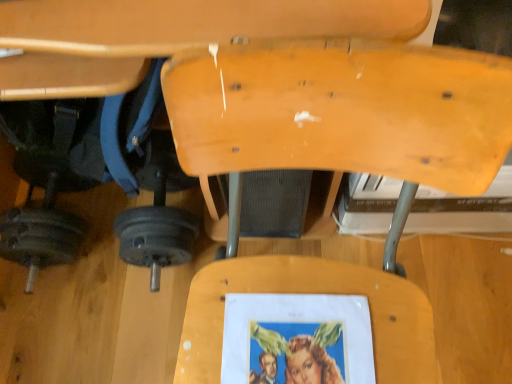
What do you see at coordinates (157, 230) in the screenshot? I see `dark gray metallic barbell at lower left` at bounding box center [157, 230].

Measure the distance between point (176, 250) and camera.

Point (176, 250) and camera are 1.03 meters apart from each other.

This screenshot has height=384, width=512. In order to click on dark gray metallic barbell at lower left in this screenshot , I will do `click(157, 230)`.

In order to face wooden swivel chair at center, should I rotate leftwards or rightwards?

Rotate your view left by about 20.195°.

This screenshot has height=384, width=512. I want to click on wooden swivel chair at center, so click(343, 111).

What is the approximate width of wooden swivel chair at center?

28.34 inches.

The height and width of the screenshot is (384, 512). What do you see at coordinates (343, 111) in the screenshot? I see `wooden swivel chair at center` at bounding box center [343, 111].

The width and height of the screenshot is (512, 384). I want to click on dark gray metallic barbell at lower left, so click(157, 230).

Considering the positions of objects dark gray metallic barbell at lower left and wooden swivel chair at center in the image provided, who is more to the left, dark gray metallic barbell at lower left or wooden swivel chair at center?

Positioned to the left is dark gray metallic barbell at lower left.

In the scene shown: Relative to wooden swivel chair at center, is dark gray metallic barbell at lower left in front or behind?

dark gray metallic barbell at lower left is positioned farther from the viewer than wooden swivel chair at center.

Is point (115, 229) less distant than point (316, 74)?

No, it is behind (316, 74).

From the image's perspective, does dark gray metallic barbell at lower left appear higher than wooden swivel chair at center?

No, from the image's perspective, dark gray metallic barbell at lower left is not on top of wooden swivel chair at center.

From a real-world perspective, is dark gray metallic barbell at lower left positioned under wooden swivel chair at center based on gravity?

Correct, in the physical world, dark gray metallic barbell at lower left is lower than wooden swivel chair at center.

Between dark gray metallic barbell at lower left and wooden swivel chair at center, which one has smaller width?

dark gray metallic barbell at lower left.

Consider the image. Which of these two, dark gray metallic barbell at lower left or wooden swivel chair at center, stands taller?

With more height is wooden swivel chair at center.

Can you confirm if dark gray metallic barbell at lower left is smaller than wooden swivel chair at center?

Yes, dark gray metallic barbell at lower left is smaller than wooden swivel chair at center.

Would you say dark gray metallic barbell at lower left is inside or outside wooden swivel chair at center?

The correct answer is: inside.

Are dark gray metallic barbell at lower left and wooden swivel chair at center making contact?

dark gray metallic barbell at lower left and wooden swivel chair at center are not in contact.

Is dark gray metallic barbell at lower left facing towards wooden swivel chair at center?

Yes, dark gray metallic barbell at lower left is facing wooden swivel chair at center.

Measure the distance from dark gray metallic barbell at lower left to wooden swivel chair at center.

The distance of dark gray metallic barbell at lower left from wooden swivel chair at center is 59.33 centimeters.

Identify the location of swivel chair above the dark gray metallic barbell at lower left (from a real-world perspective). (343, 111).

Which is more to the right, wooden swivel chair at center or dark gray metallic barbell at lower left?

From the viewer's perspective, wooden swivel chair at center appears more on the right side.

Is wooden swivel chair at center positioned behind dark gray metallic barbell at lower left?

No, wooden swivel chair at center is closer to the camera.

Is point (248, 91) closer to camera compared to point (49, 225)?

Yes.

From the image's perspective, which is above, wooden swivel chair at center or dark gray metallic barbell at lower left?

wooden swivel chair at center is shown above in the image.

From a real-world perspective, is wooden swivel chair at center on top of dark gray metallic barbell at lower left?

Correct, in the physical world, wooden swivel chair at center is higher than dark gray metallic barbell at lower left.

Does wooden swivel chair at center have a greater width compared to dark gray metallic barbell at lower left?

Yes, wooden swivel chair at center is wider than dark gray metallic barbell at lower left.

From their relative heights in the image, would you say wooden swivel chair at center is taller or shorter than dark gray metallic barbell at lower left?

wooden swivel chair at center is taller than dark gray metallic barbell at lower left.

Is wooden swivel chair at center bigger than dark gray metallic barbell at lower left?

Yes, wooden swivel chair at center is bigger than dark gray metallic barbell at lower left.

Is dark gray metallic barbell at lower left a part of wooden swivel chair at center?

Yes, dark gray metallic barbell at lower left can be found within wooden swivel chair at center.

Is wooden swivel chair at center with dark gray metallic barbell at lower left?

wooden swivel chair at center and dark gray metallic barbell at lower left are clearly separated.

Is wooden swivel chair at center turned away from dark gray metallic barbell at lower left?

No, wooden swivel chair at center is not facing away from dark gray metallic barbell at lower left.

Identify the location of swivel chair that is on the right side of dark gray metallic barbell at lower left. The width and height of the screenshot is (512, 384). (343, 111).

Find the location of a particular element. The height and width of the screenshot is (384, 512). barbell below the wooden swivel chair at center (from a real-world perspective) is located at coordinates (157, 230).

The width and height of the screenshot is (512, 384). Identify the location of swivel chair above the dark gray metallic barbell at lower left (from the image's perspective). (343, 111).